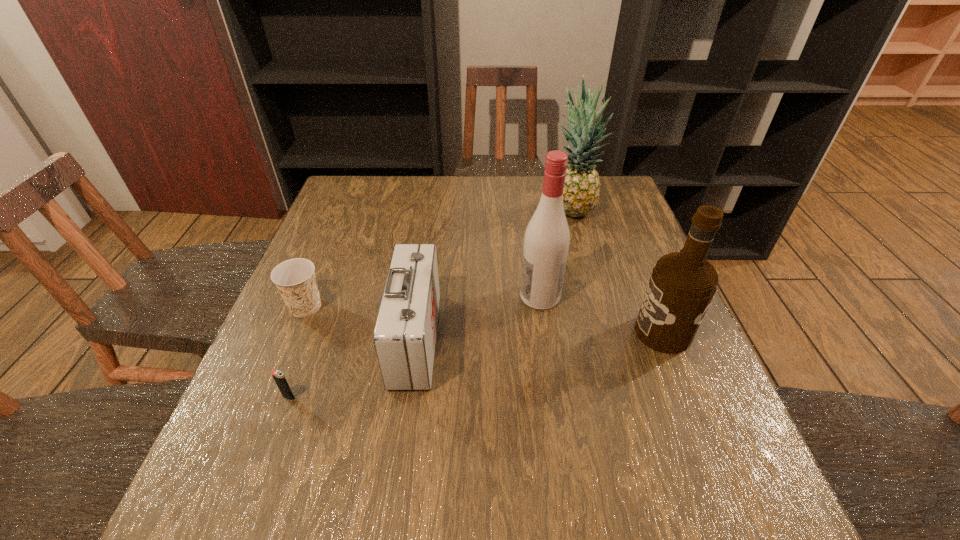
Locate an element on the screen. The image size is (960, 540). vacant area that lies between the left alcohol and the fourth tallest object is located at coordinates (478, 318).

Find the location of `empty space between the farther alcohol and the third shortest object`. empty space between the farther alcohol and the third shortest object is located at coordinates point(478,318).

This screenshot has width=960, height=540. What are the coordinates of `empty space that is in between the Dixie cup and the third tallest object` in the screenshot? It's located at (484, 320).

I want to click on vacant space in between the first-aid kit and the left alcohol, so click(478, 318).

This screenshot has width=960, height=540. I want to click on free space that is in between the fourth tallest object and the farthest object, so click(493, 275).

Identify the location of object that stands as the second closest to the shortest object. The image size is (960, 540). (295, 279).

Find the location of a particular element. the fifth closest object to the third object from left to right is located at coordinates (682, 285).

The height and width of the screenshot is (540, 960). I want to click on free location that satisfies the following two spatial constraints: 1. on the front side of the farthest object; 2. on the label of the left alcohol, so click(594, 296).

Identify the location of free location that satisfies the following two spatial constraints: 1. on the front side of the pineapple; 2. on the label of the fourth object from left to right. The width and height of the screenshot is (960, 540). (594, 296).